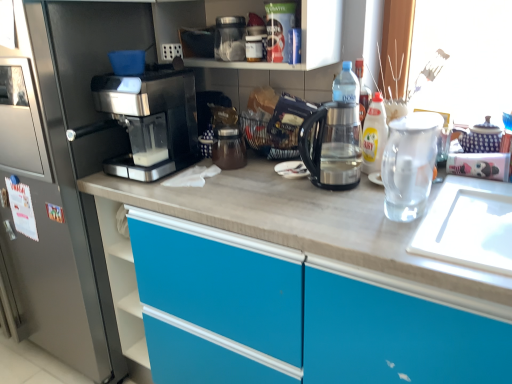
Describe the element at coordinates (44, 209) in the screenshot. I see `sleek black coffee machine at left` at that location.

Locate an element on the screen. yellow glossy bottle at upper right is located at coordinates tap(374, 135).

Find the location of a particular element. sleek black coffee machine at left is located at coordinates (44, 209).

Would you say transparent plastic container at upper center is a long distance from transparent plastic kettle at center?

That's not correct — transparent plastic container at upper center is a little close to transparent plastic kettle at center.

Is transparent plastic container at upper center to the right of transparent plastic kettle at center from the viewer's perspective?

In fact, transparent plastic container at upper center is to the left of transparent plastic kettle at center.

Is transparent plastic kettle at center at the back of transparent plastic container at upper center?

No.

From the image's perspective, would you say transparent plastic container at upper center is shown under transparent plastic kettle at center?

Incorrect, from the image's perspective, transparent plastic container at upper center is higher than transparent plastic kettle at center.

Which object is closer to the camera, transparent plastic kettle at center or sleek metallic coffee maker at left?

transparent plastic kettle at center is closer to the camera.

Is transparent plastic kettle at center thinner than sleek metallic coffee maker at left?

Indeed, transparent plastic kettle at center has a lesser width compared to sleek metallic coffee maker at left.

Can you tell me how much transparent plastic kettle at center and sleek metallic coffee maker at left differ in facing direction?

The angle between the facing direction of transparent plastic kettle at center and the facing direction of sleek metallic coffee maker at left is 0.000432 degrees.

Is transparent plastic kettle at center situated inside sleek metallic coffee maker at left or outside?

The correct answer is: outside.

The height and width of the screenshot is (384, 512). In order to click on home appliance to the left of yellow glossy bottle at upper right in this screenshot , I will do `click(44, 209)`.

Is yellow glossy bottle at upper right beside sleek black coffee machine at left?

There is a gap between yellow glossy bottle at upper right and sleek black coffee machine at left.

Do you think yellow glossy bottle at upper right is within sleek black coffee machine at left, or outside of it?

yellow glossy bottle at upper right lies outside sleek black coffee machine at left.

Can you tell me how much transparent plastic container at upper center and sleek black coffee machine at left differ in facing direction?

The angular difference between transparent plastic container at upper center and sleek black coffee machine at left is 0.0687 degrees.

Choose the correct answer: Is transparent plastic container at upper center inside sleek black coffee machine at left or outside it?

transparent plastic container at upper center lies outside sleek black coffee machine at left.

From the image's perspective, which is below, transparent plastic container at upper center or sleek black coffee machine at left?

sleek black coffee machine at left.

Based on their sizes in the image, would you say transparent plastic container at upper center is bigger or smaller than transparent glass tea pot at right?

Clearly, transparent plastic container at upper center is smaller in size than transparent glass tea pot at right.

In the image, is transparent plastic container at upper center positioned in front of or behind transparent glass tea pot at right?

Clearly, transparent plastic container at upper center is behind transparent glass tea pot at right.

Based on the photo, is transparent plastic container at upper center spatially inside transparent glass tea pot at right, or outside of it?

transparent plastic container at upper center is located beyond the bounds of transparent glass tea pot at right.

How many degrees apart are the facing directions of transparent plastic container at upper center and transparent glass tea pot at right?

transparent plastic container at upper center and transparent glass tea pot at right are facing 0.0688 degrees away from each other.

From a real-world perspective, relative to yellow glossy bottle at upper right, is transparent glass tea pot at right vertically above or below?

Clearly, from a real-world perspective, transparent glass tea pot at right is above yellow glossy bottle at upper right.

Would you say transparent glass tea pot at right is a long distance from yellow glossy bottle at upper right?

transparent glass tea pot at right is actually quite close to yellow glossy bottle at upper right.

Considering the positions of objects transparent glass tea pot at right and yellow glossy bottle at upper right in the image provided, who is more to the left, transparent glass tea pot at right or yellow glossy bottle at upper right?

yellow glossy bottle at upper right is more to the left.

Looking at this image, can you confirm if transparent plastic container at upper center is smaller than yellow glossy bottle at upper right?

No, transparent plastic container at upper center is not smaller than yellow glossy bottle at upper right.

In the scene shown: From the image's perspective, relative to yellow glossy bottle at upper right, is transparent plastic container at upper center above or below?

From the image's perspective, transparent plastic container at upper center appears above yellow glossy bottle at upper right.

Which point is more forward, [229,33] or [376,162]?

The point [376,162] is more forward.

From a real-world perspective, does transparent plastic container at upper center sit lower than yellow glossy bottle at upper right?

No.

This screenshot has height=384, width=512. Identify the location of appliance above the transparent plastic kettle at center (from the image's perspective). (230, 38).

Find the location of a particular element. The height and width of the screenshot is (384, 512). kitchen appliance that is under the sleek metallic coffee maker at left (from a real-world perspective) is located at coordinates (333, 146).

Looking at this image, based on their spatial positions, is transparent glass tea pot at right or transparent plastic container at upper center closer to transparent plastic kettle at center?

transparent glass tea pot at right.

Which object lies further to the anchor point transparent glass tea pot at right, transparent plastic container at upper center or sleek black coffee machine at left?

Based on the image, sleek black coffee machine at left appears to be further to transparent glass tea pot at right.

Based on their spatial positions, is yellow glossy bottle at upper right or transparent plastic container at upper center closer to transparent plastic kettle at center?

yellow glossy bottle at upper right is positioned closer to the anchor transparent plastic kettle at center.

Which object lies further to the anchor point transparent plastic kettle at center, yellow glossy bottle at upper right or sleek black coffee machine at left?

Among the two, sleek black coffee machine at left is located further to transparent plastic kettle at center.

Estimate the real-world distances between objects in this image. Which object is closer to transparent plastic kettle at center, sleek black coffee machine at left or sleek metallic coffee maker at left?

Based on the image, sleek metallic coffee maker at left appears to be nearer to transparent plastic kettle at center.

Which object lies further to the anchor point transparent glass tea pot at right, yellow glossy bottle at upper right or transparent plastic kettle at center?

transparent plastic kettle at center is further to transparent glass tea pot at right.

Estimate the real-world distances between objects in this image. Which object is closer to sleek metallic coffee maker at left, transparent plastic kettle at center or sleek black coffee machine at left?

Among the two, sleek black coffee machine at left is located nearer to sleek metallic coffee maker at left.

Which object lies further to the anchor point transparent plastic container at upper center, yellow glossy bottle at upper right or transparent glass tea pot at right?

The object further to transparent plastic container at upper center is transparent glass tea pot at right.

Find the location of a particular element. Image resolution: width=512 pixels, height=384 pixels. coffee maker located between sleek black coffee machine at left and yellow glossy bottle at upper right in the left-right direction is located at coordinates pos(151,121).

Find the location of a particular element. appliance between sleek metallic coffee maker at left and transparent glass tea pot at right from left to right is located at coordinates (230, 38).

Where is `kitchen appliance situated between sleek metallic coffee maker at left and yellow glossy bottle at upper right from left to right`? kitchen appliance situated between sleek metallic coffee maker at left and yellow glossy bottle at upper right from left to right is located at coordinates (333, 146).

In order to click on kitchen appliance between sleek black coffee machine at left and transparent glass tea pot at right in this screenshot , I will do `click(333, 146)`.